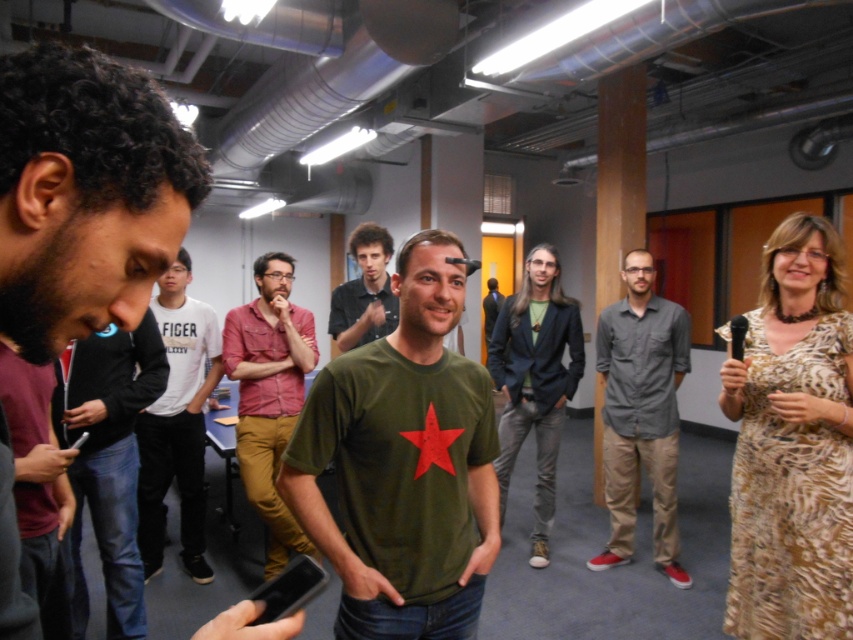
Question: Can you confirm if patterned fabric dress at center is positioned to the right of dark gray shirt at center?

Choices:
 (A) yes
 (B) no

Answer: (A)

Question: Which is farther from the gray cotton shirt at center?

Choices:
 (A) patterned fabric dress at center
 (B) green matte t-shirt at center
 (C) dark brown curly hair at left
 (D) denim shirt at center

Answer: (C)

Question: Does green matte t-shirt at center have a smaller size compared to black glossy phone at lower left?

Choices:
 (A) no
 (B) yes

Answer: (A)

Question: Based on their relative distances, which object is nearer to the black matte jacket at left?

Choices:
 (A) green matte t-shirt at center
 (B) black glossy phone at lower left

Answer: (A)

Question: Does denim shirt at center have a smaller size compared to dark green t-shirt at center?

Choices:
 (A) no
 (B) yes

Answer: (B)

Question: Estimate the real-world distances between objects in this image. Which object is closer to the patterned fabric dress at center?

Choices:
 (A) dark brown curly hair at left
 (B) dark green t-shirt at center
 (C) white cotton shirt at center
 (D) green matte t-shirt at center

Answer: (C)